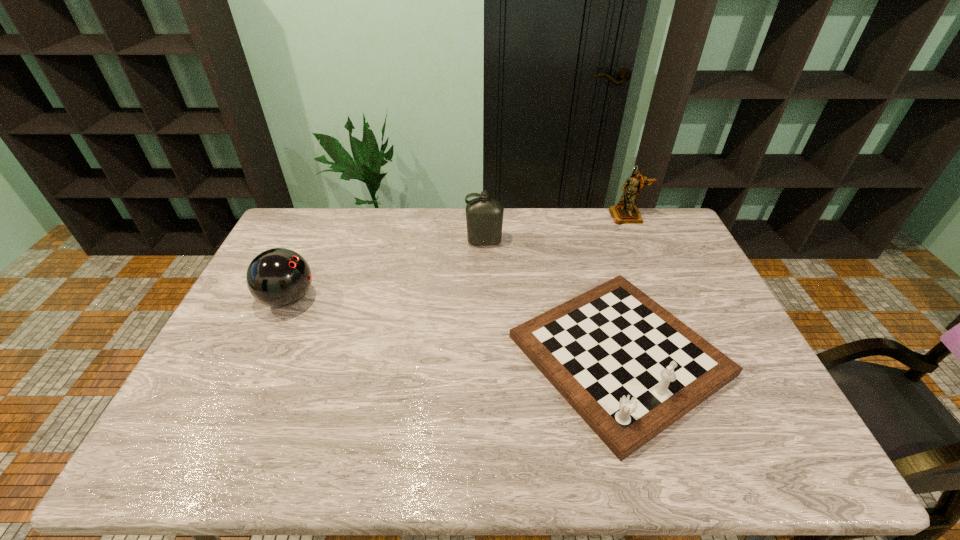
Find the location of a particular element. figurine is located at coordinates (625, 212).

Find the location of a particular element. This screenshot has height=540, width=960. the third object from right to left is located at coordinates (484, 217).

Identify the location of the third nearest object. The image size is (960, 540). (484, 217).

The width and height of the screenshot is (960, 540). Find the location of `bowling ball`. bowling ball is located at coordinates (278, 277).

The width and height of the screenshot is (960, 540). Identify the location of the leftmost object. (278, 277).

The height and width of the screenshot is (540, 960). In order to click on the shortest object in this screenshot , I will do `click(630, 369)`.

The height and width of the screenshot is (540, 960). What are the coordinates of `vacant position located 0.160m on the front-facing side of the farthest object` in the screenshot? It's located at (642, 252).

Where is `free location located on the left of the third nearest object`? free location located on the left of the third nearest object is located at coordinates (439, 242).

This screenshot has height=540, width=960. Find the location of `vacant space situated 0.160m on the surface of the leftmost object near the finger holes`. vacant space situated 0.160m on the surface of the leftmost object near the finger holes is located at coordinates (369, 299).

Locate an element on the screen. The height and width of the screenshot is (540, 960). vacant space located 0.340m on the back of the gameboard is located at coordinates (580, 221).